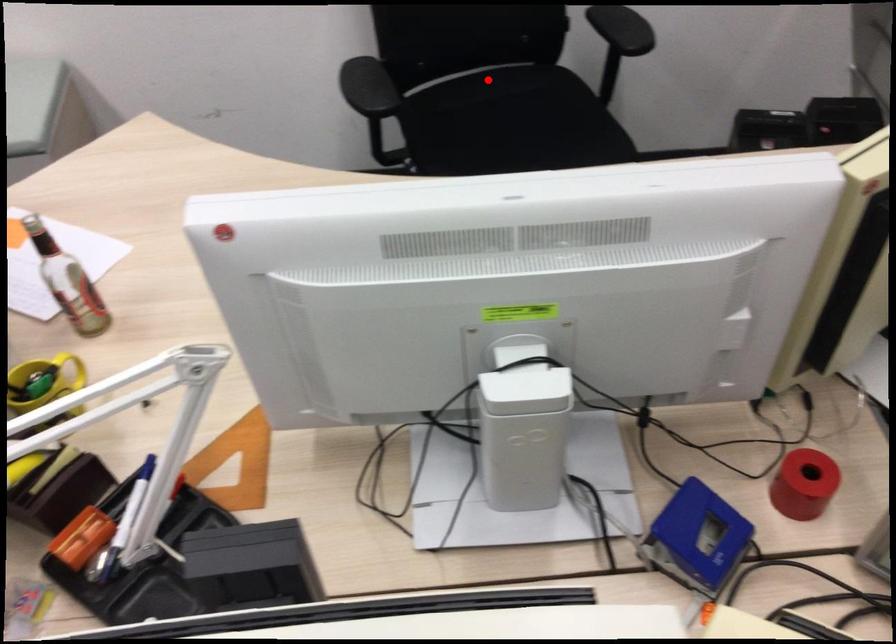
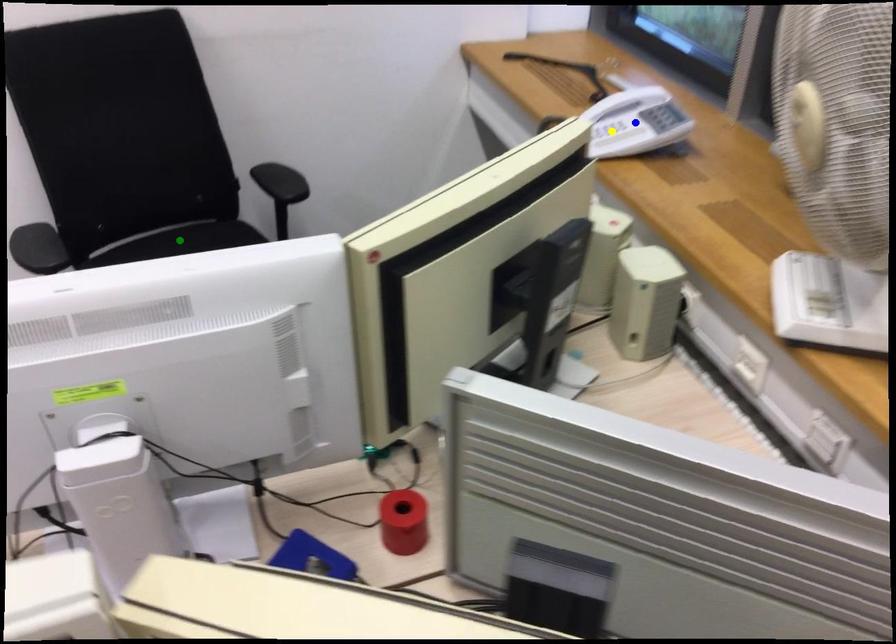
Question: I am providing you with two images of the same scene from different viewpoints. A red point is marked on the first image. You are given multiple points on the second image. Which point in image 2 represents the same 3d spot as the red point in image 1?

Choices:
 (A) yellow point
 (B) green point
 (C) blue point

Answer: (B)